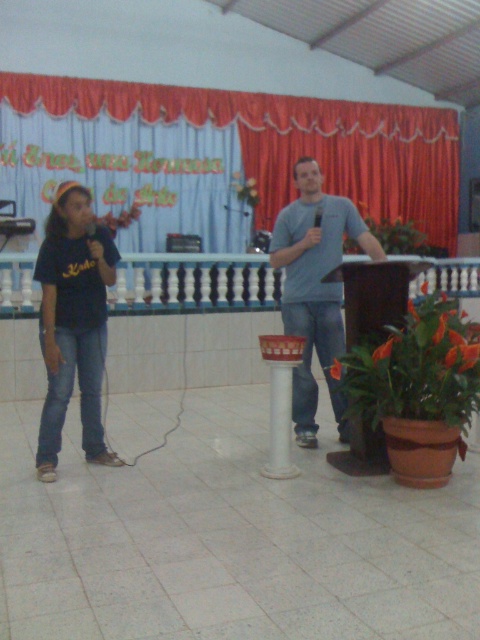
Which is behind, point (36, 99) or point (479, 264)?

The point (479, 264) is more distant.

Who is more forward, (376, 138) or (432, 269)?

Positioned in front is point (432, 269).

The width and height of the screenshot is (480, 640). Find the location of `blue fabric curtain at upper center`. blue fabric curtain at upper center is located at coordinates (291, 141).

Which is more to the right, blue fabric curtain at upper center or matte black shirt at left?

Positioned to the right is blue fabric curtain at upper center.

Which is above, blue fabric curtain at upper center or matte black shirt at left?

blue fabric curtain at upper center is above.

Find the location of a particular element. blue fabric curtain at upper center is located at coordinates (291, 141).

Where is `blue fabric curtain at upper center`? The height and width of the screenshot is (640, 480). blue fabric curtain at upper center is located at coordinates (291, 141).

Which of these two, matte black shirt at left or white balustrade at center, stands shorter?

With less height is white balustrade at center.

From the picture: Is matte black shirt at left wider than white balustrade at center?

Incorrect, matte black shirt at left's width does not surpass white balustrade at center's.

Between point (87, 304) and point (120, 308), which one is positioned in front?

Point (87, 304) is more forward.

This screenshot has height=640, width=480. Identify the location of matte black shirt at left. (73, 323).